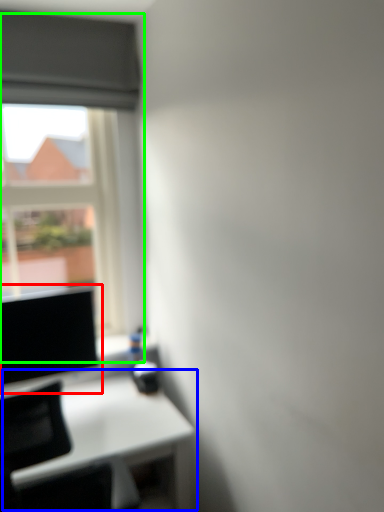
Question: Which object is the farthest from computer screen (highlighted by a red box)? Choose among these: table (highlighted by a blue box) or window (highlighted by a green box).

Choices:
 (A) table
 (B) window

Answer: (B)